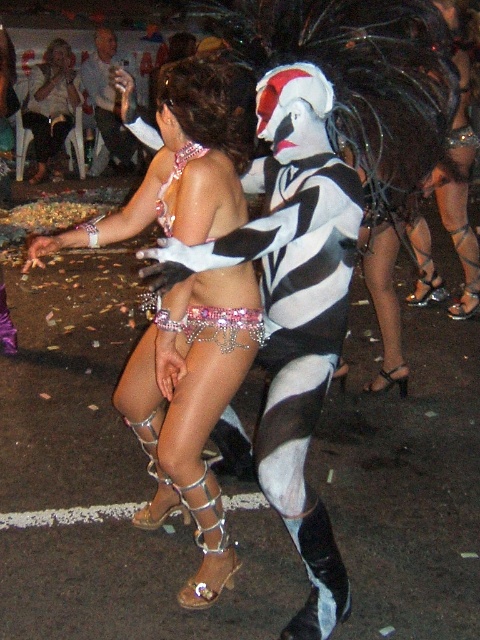
Question: Which point is farther from the camera taking this photo?

Choices:
 (A) (274, 77)
 (B) (252, 508)
 (C) (34, 262)

Answer: (B)

Question: Where is metallic silver chainmail at lower center located in relation to pink sequined bikini top at center in the image?

Choices:
 (A) left
 (B) right

Answer: (A)

Question: Estimate the real-world distances between objects in this image. Which object is closer to the shiny silver bikini at center?

Choices:
 (A) light blue shirt at upper left
 (B) matte white blouse at upper left

Answer: (B)

Question: Considering the real-world distances, which object is closest to the light blue shirt at upper left?

Choices:
 (A) shiny silver bikini at center
 (B) metallic silver chainmail at lower center
 (C) pink sequined bikini top at center
 (D) sparkly silver bikini at center

Answer: (A)

Question: Is sparkly silver bikini at center below matte white blouse at upper left?

Choices:
 (A) yes
 (B) no

Answer: (A)

Question: Can you confirm if shiny silver bikini at center is positioned below sparkly silver bikini at center?

Choices:
 (A) no
 (B) yes

Answer: (A)